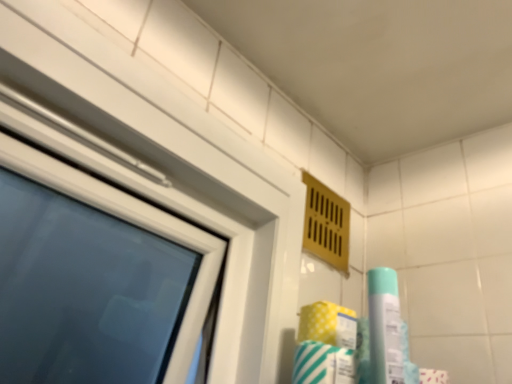
Image resolution: width=512 pixels, height=384 pixels. Describe the element at coordinates (384, 326) in the screenshot. I see `teal matte spray can at lower right` at that location.

Locate an element on the screen. The image size is (512, 384). teal matte spray can at lower right is located at coordinates (384, 326).

Where is `teal matte spray can at lower right`? teal matte spray can at lower right is located at coordinates (384, 326).